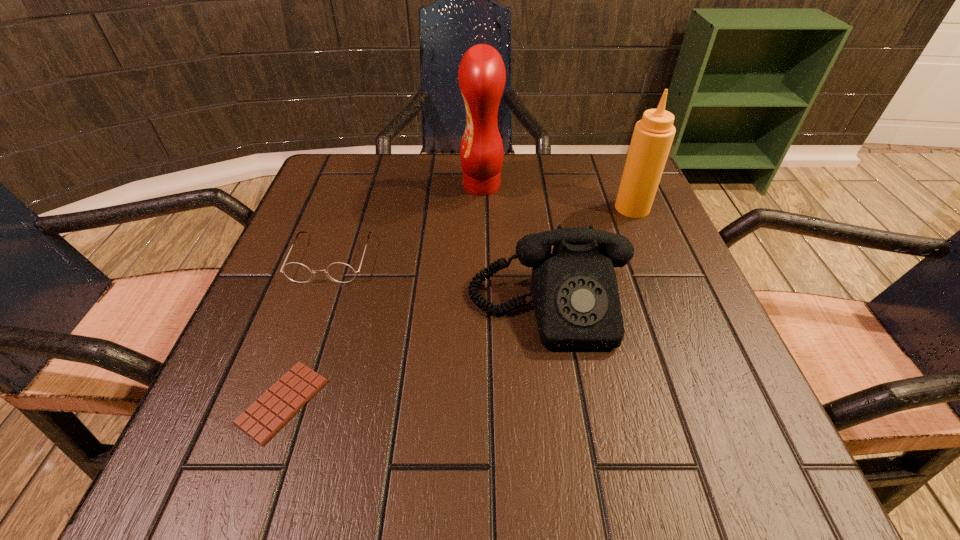
At what (x,y) coordinates should I click in order to perform the action: click on free point at the far edge. Please return your answer as a coordinate pair (x, y). Looking at the image, I should click on (474, 212).

Image resolution: width=960 pixels, height=540 pixels. Find the location of `blank space at the near edge of the desktop`. blank space at the near edge of the desktop is located at coordinates (336, 438).

This screenshot has width=960, height=540. I want to click on blank space at the left edge of the desktop, so click(310, 329).

I want to click on vacant space at the right edge of the desktop, so click(x=646, y=261).

Locate an element on the screen. Image resolution: width=960 pixels, height=540 pixels. vacant space at the far left corner of the desktop is located at coordinates (326, 176).

The image size is (960, 540). Identify the location of free space between the right condiment and the shortest object. (458, 305).

I want to click on unoccupied area between the shortest object and the left condiment, so click(x=382, y=294).

This screenshot has height=540, width=960. Identify the location of vacant region between the candy bar and the telephone. (416, 355).

At what (x,y) coordinates should I click in order to perform the action: click on vacant space that's between the second shortest object and the left condiment. Please return your answer as a coordinate pair (x, y). The height and width of the screenshot is (540, 960). Looking at the image, I should click on (407, 222).

Where is `unoccupied position between the second shortest object and the nearest object`? Image resolution: width=960 pixels, height=540 pixels. unoccupied position between the second shortest object and the nearest object is located at coordinates (307, 330).